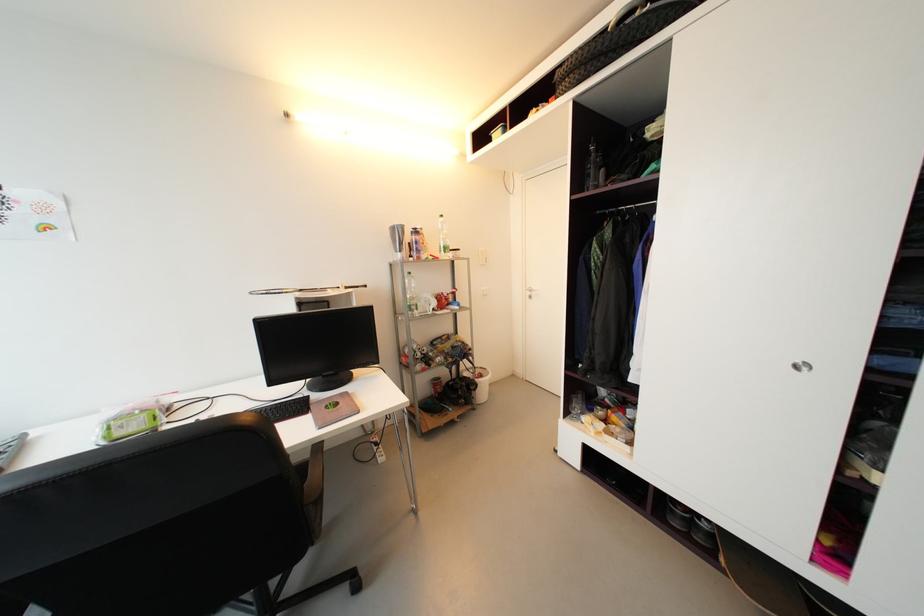
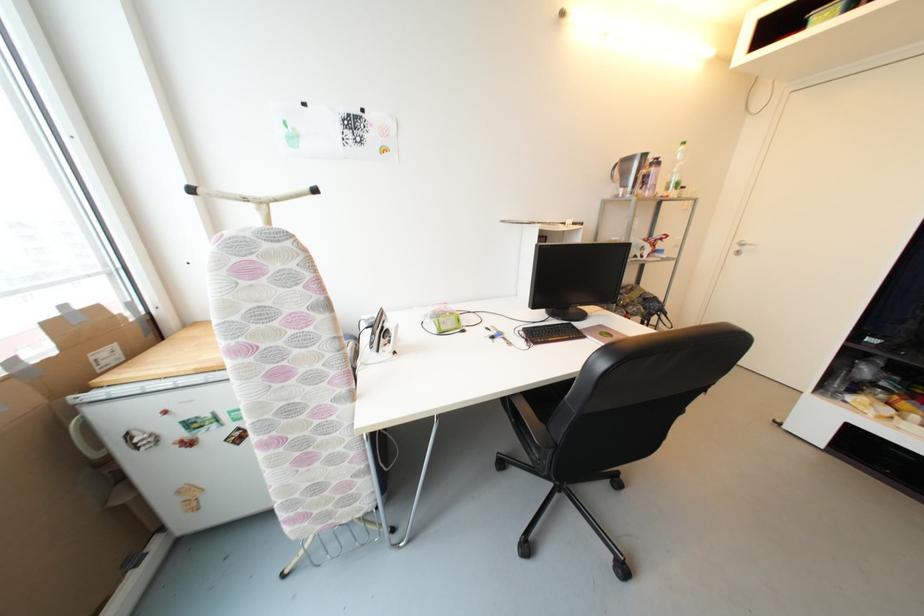
The point at (445,253) is marked in the first image. Where is the corresponding point in the second image?

(673, 190)